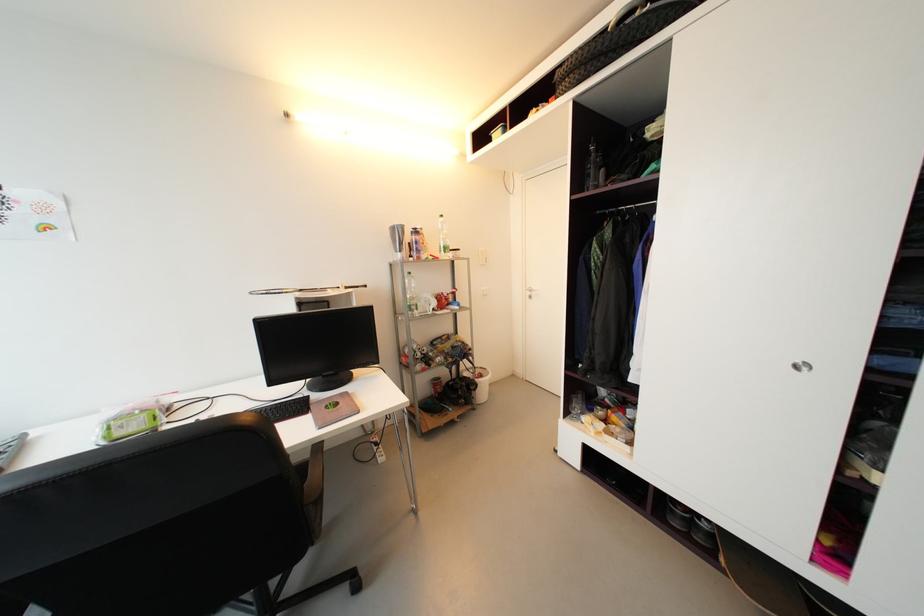
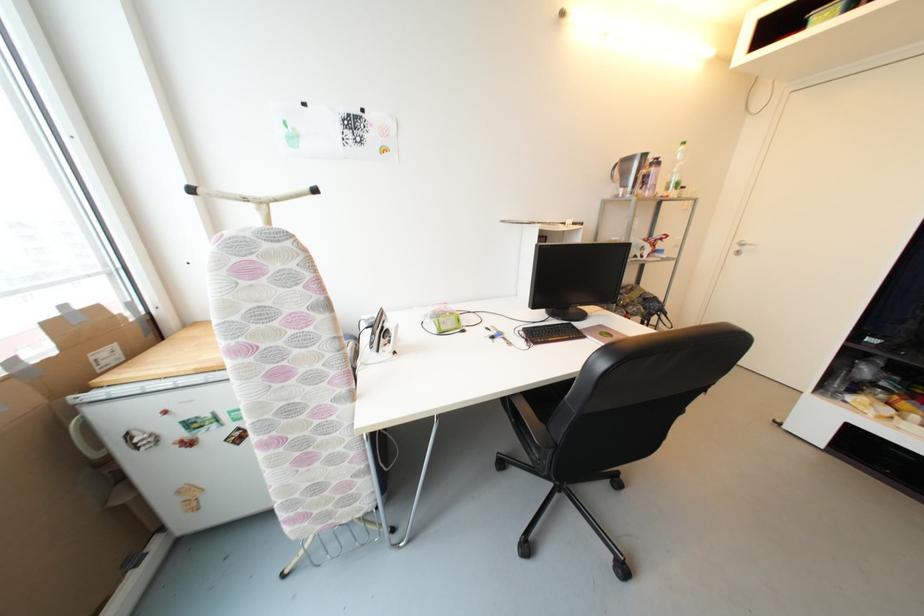
The point at (445,253) is marked in the first image. Where is the corresponding point in the second image?

(673, 190)